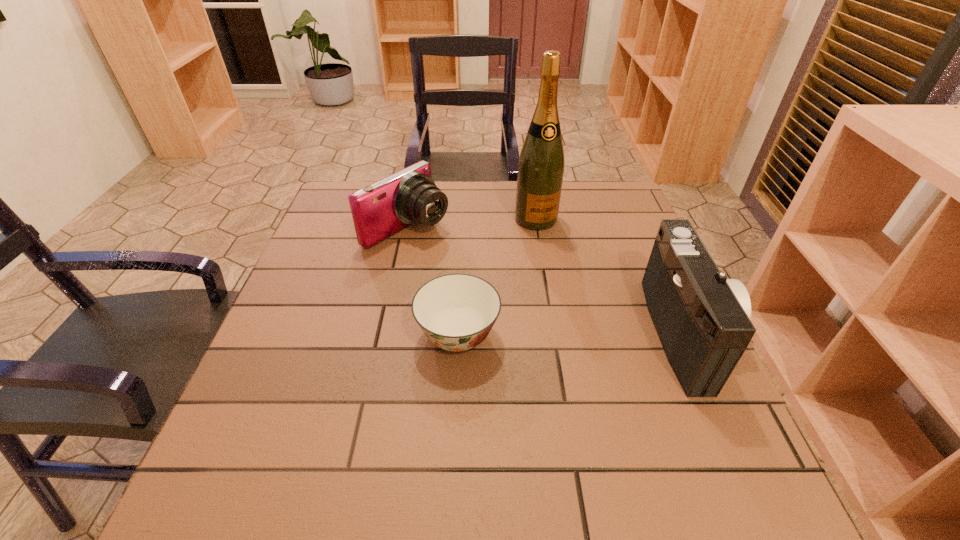
The height and width of the screenshot is (540, 960). In order to click on free space on the desktop that is between the soup bowl and the third shortest object and is positioned on the front-facing side of the wine bottle in this screenshot , I will do `click(597, 334)`.

Locate an element on the screen. The image size is (960, 540). free spot on the desktop that is between the shortest object and the rightmost object and is positioned on the front-facing side of the second shortest object is located at coordinates (583, 334).